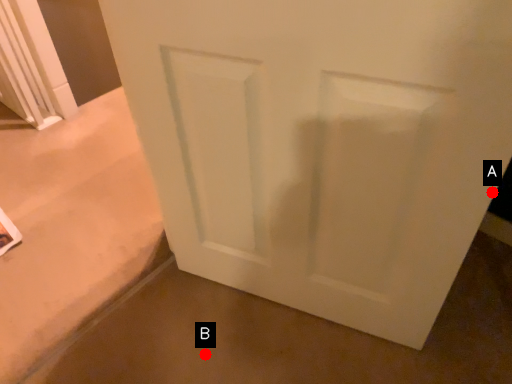
Question: Two points are circled on the image, labeled by A and B beside each circle. Among these points, which one is farthest from the camera?

Choices:
 (A) A is further
 (B) B is further

Answer: (B)